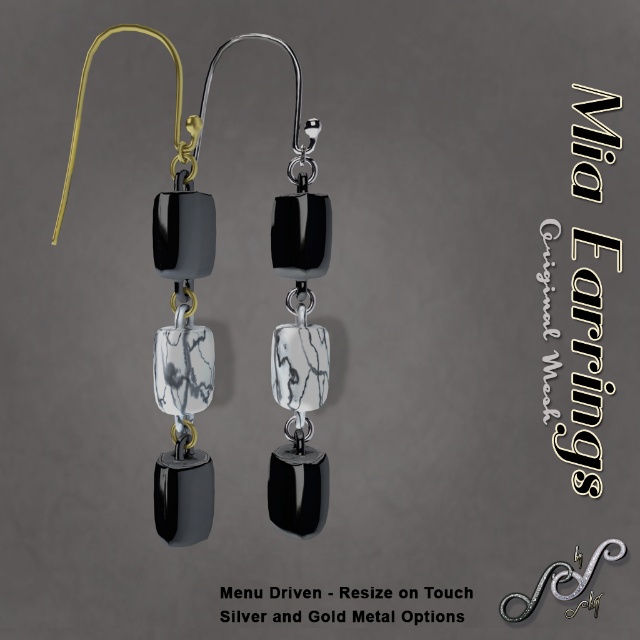
You are a customer trying to decide whether to place the matte black earrings at center into the silver metallic hook at upper left. The store has a rule that items must be within 12 inches to be considered a matching set. Based on the image, will these two items qualify as a matching set?

The matte black earrings at center and silver metallic hook at upper left are 13.67 inches apart from each other. Since the required distance for a matching set is 12 inches, the items are too far apart to qualify as a matching set.

Looking at this image, you are an appraiser examining the Mia Earrings. You need to determine which object is closer to you between the matte black earrings at center and the silver metallic hook at upper left. Which one is closer?

The matte black earrings at center are closer to the viewer than the silver metallic hook at upper left.

You are a jeweler examining the Mia Earrings. You notice the matte black earrings at center and the silver metallic hook at upper left. Which object has a greater height?

The matte black earrings at center is taller than the silver metallic hook at upper left according to the description.